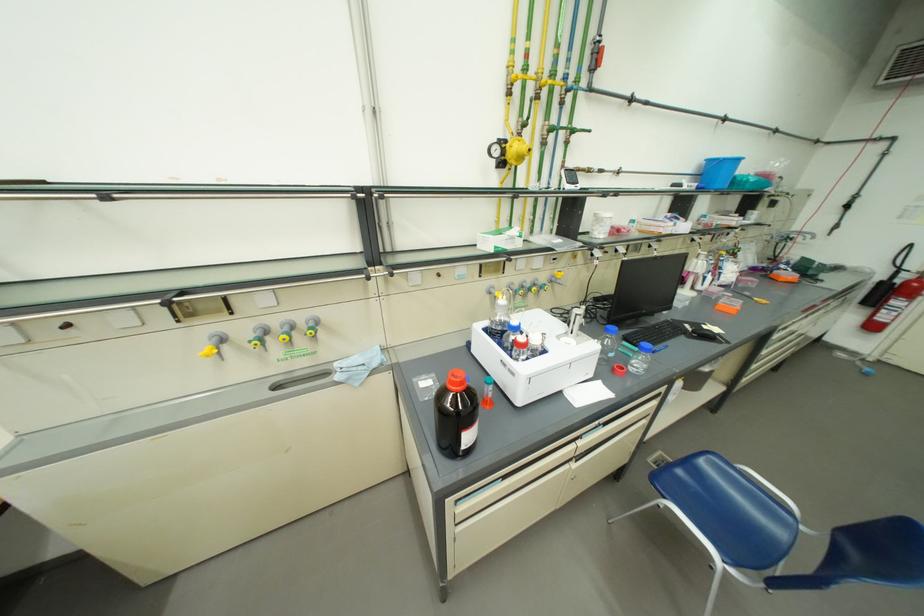
This screenshot has width=924, height=616. Find the location of `green valve handle`. green valve handle is located at coordinates (259, 336).